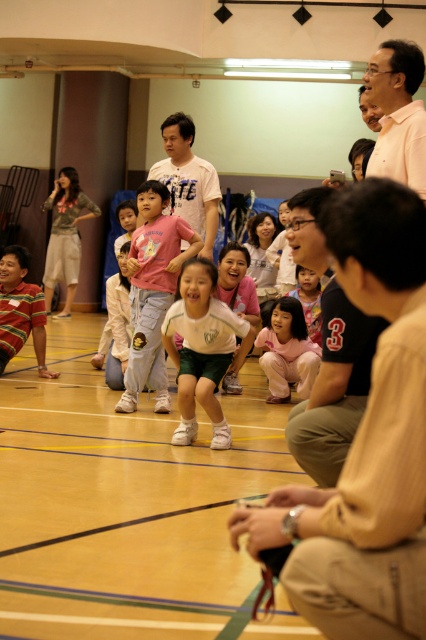
Who is positioned more to the right, white matte shorts at center or white matte shirt at center?

white matte shorts at center

Can you confirm if white matte shorts at center is smaller than white matte shirt at center?

Yes, white matte shorts at center is smaller than white matte shirt at center.

Describe the element at coordinates (203, 349) in the screenshot. I see `white matte shorts at center` at that location.

Find the location of a particular element. white matte shorts at center is located at coordinates (203, 349).

Who is lower down, pink fabric pants at center or striped cotton shirt at lower left?

pink fabric pants at center is below.

Measure the distance between point (276, 326) and camera.

They are 7.40 meters apart.

Describe the element at coordinates (287, 352) in the screenshot. I see `pink fabric pants at center` at that location.

This screenshot has width=426, height=640. I want to click on pink fabric pants at center, so click(x=287, y=352).

Who is more distant from viewer, (414, 401) or (339, 300)?

The point (339, 300) is more distant.

What do you see at coordinates (365, 442) in the screenshot? The height and width of the screenshot is (640, 426). I see `black shirt at center` at bounding box center [365, 442].

Is point (412, 346) closer to camera compared to point (299, 253)?

Yes, it is.

Where is `black shirt at center`? This screenshot has width=426, height=640. black shirt at center is located at coordinates (365, 442).